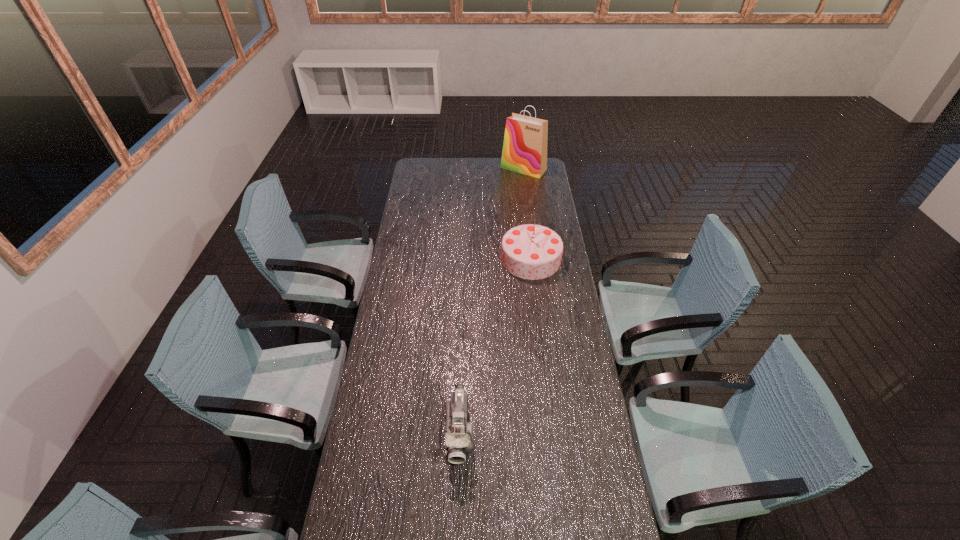
Find the location of a particular element. The image size is (960, 540). shopping bag located at the right edge is located at coordinates [524, 151].

Find the location of a particular element. This screenshot has height=540, width=960. birthday cake that is at the right edge is located at coordinates (529, 251).

You are a GUI agent. You are given a task and a screenshot of the screen. Output one action in this format:
    pyautogui.click(x=<x>, y=<y>)
    Task: Click on the object at the far right corner
    The image size is (960, 540).
    Given the screenshot: What is the action you would take?
    pyautogui.click(x=524, y=151)

In the image, there is a desktop. At what (x,y) coordinates should I click in order to perform the action: click on vacant region at the far edge. Please return your answer as a coordinate pair (x, y). The width and height of the screenshot is (960, 540). Looking at the image, I should click on (454, 167).

The height and width of the screenshot is (540, 960). Identify the location of vacant region at the left edge of the desktop. (417, 226).

This screenshot has height=540, width=960. I want to click on free space at the right edge of the desktop, so click(574, 398).

You are a GUI agent. You are given a task and a screenshot of the screen. Output one action in this format:
    pyautogui.click(x=<x>, y=<y>)
    Task: Click on the free space between the second shortest object and the shopping bag
    The image size is (960, 540).
    Given the screenshot: What is the action you would take?
    [527, 214]

What are the coordinates of `unoccupied position between the farthest object and the camcorder` in the screenshot? It's located at (x=492, y=300).

You are a GUI agent. You are given a task and a screenshot of the screen. Output one action in this format:
    pyautogui.click(x=<x>, y=<y>)
    Task: Click on the vacant space that's between the shortest object and the farthest object
    
    Given the screenshot: What is the action you would take?
    492,300

Identify which object is located as the nearest to the nearest object. Please provide its 2D coordinates. Your answer should be formatted as a tuple, i.e. [(x, y)], where the tuple contains the x and y coordinates of a point satisfying the conditions above.

[(529, 251)]